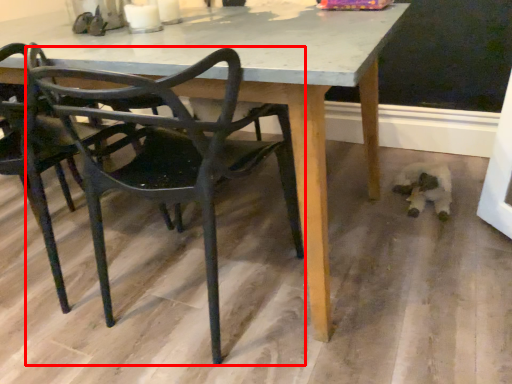
Question: Where is chair (annotated by the red box) located in relation to chair in the image?

Choices:
 (A) left
 (B) right

Answer: (B)